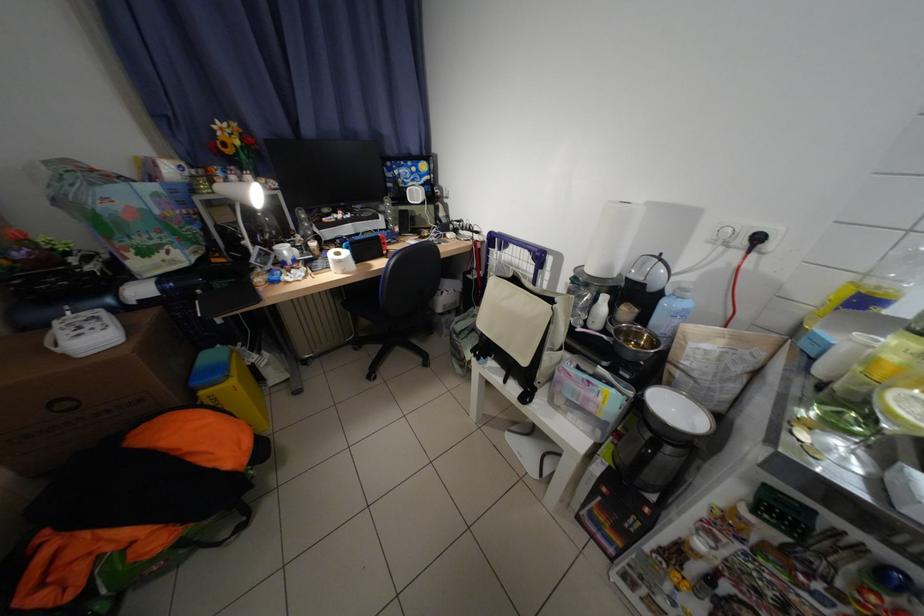
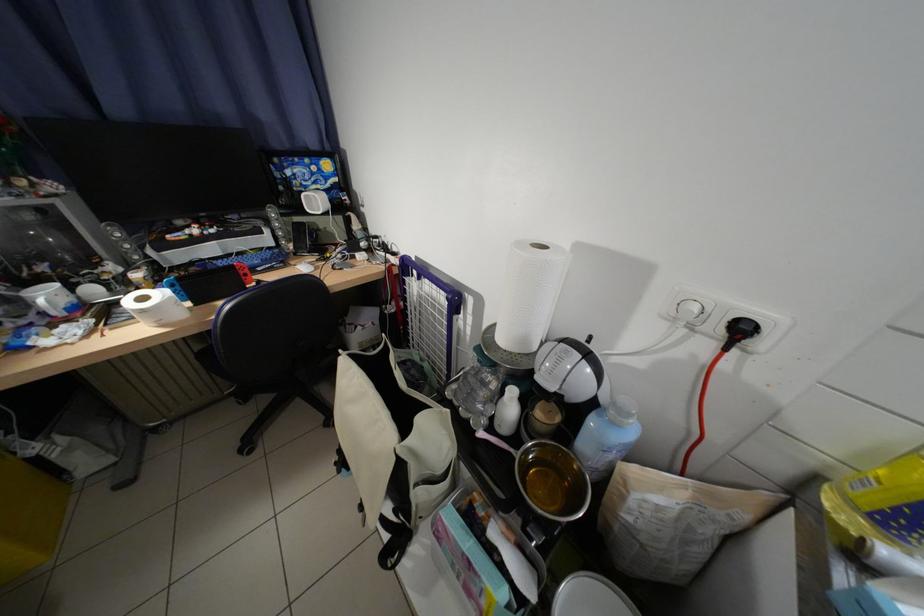
Locate, in the second image, the point that corresponds to [297,252] in the first image.

(59, 297)